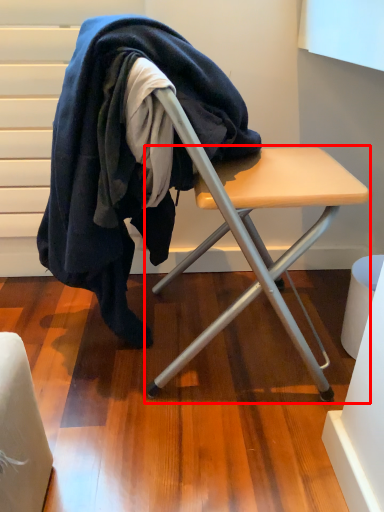
Question: From the image's perspective, where is table (annotated by the red box) located in relation to wool in the image?

Choices:
 (A) below
 (B) above

Answer: (A)